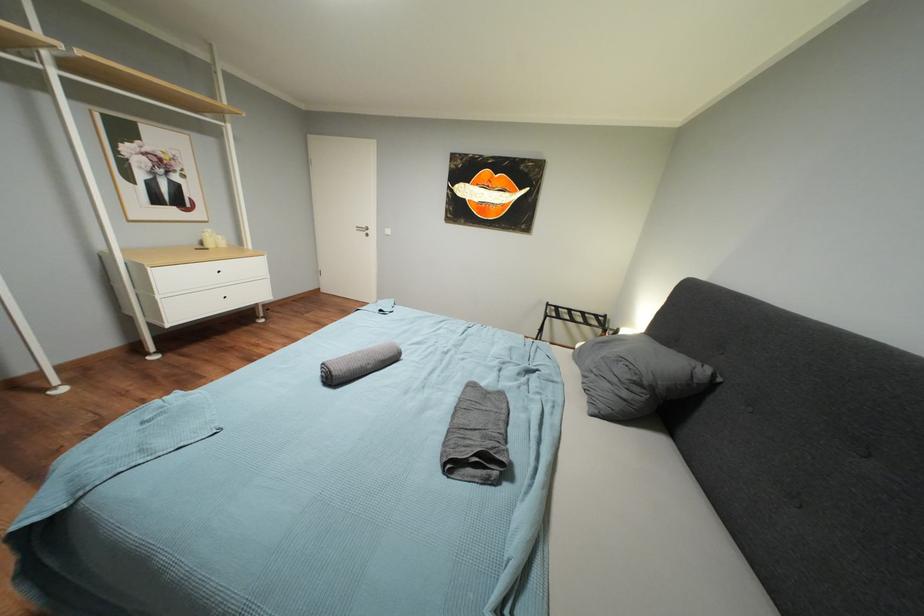
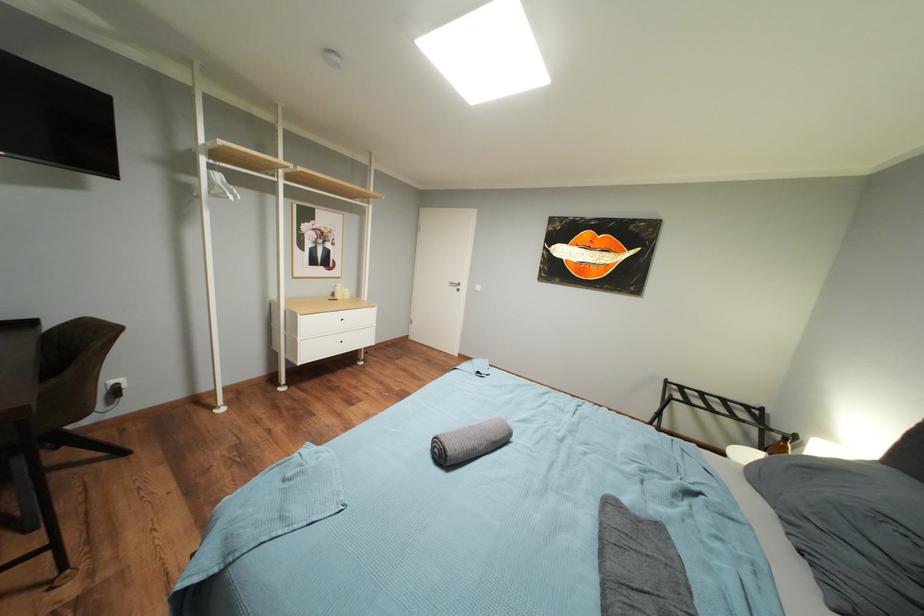
Question: What movement of the cameraman would produce the second image?

Choices:
 (A) Left
 (B) Right
 (C) Forward
 (D) Backward

Answer: (A)